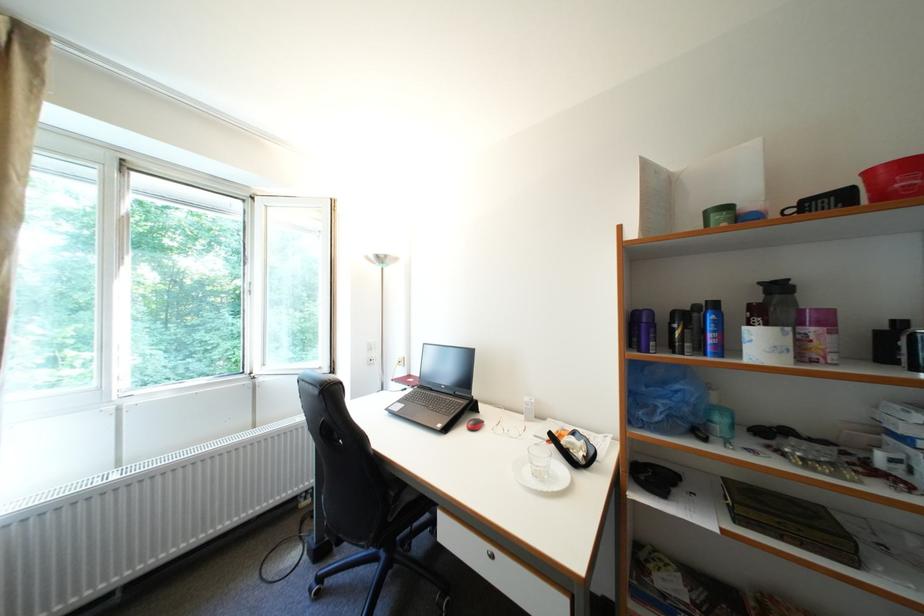
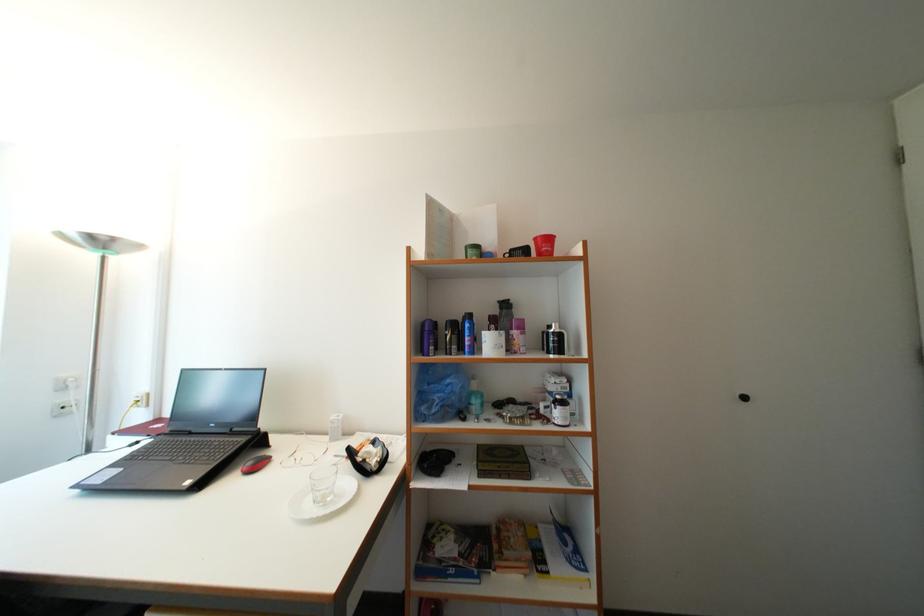
Question: How did the camera likely rotate?

Choices:
 (A) Left
 (B) Right
 (C) Up
 (D) Down

Answer: (B)